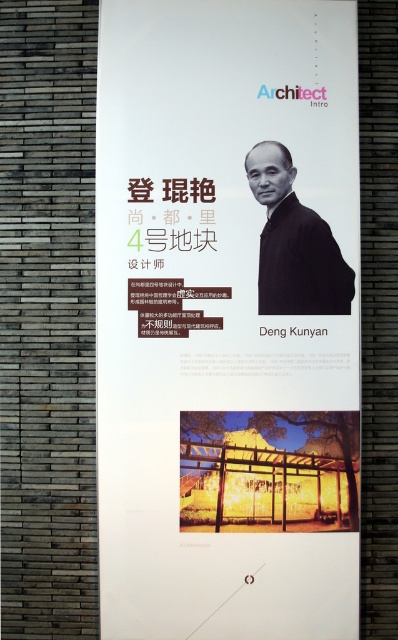
You are an interior designer planning to hang two items on a wall. You have a matte black portrait at upper center and a black matte jacket at upper right. Based on the poster design, which object should you choose to place on the left side if you want the wider item to be on the left?

The matte black portrait at upper center has a larger width than the black matte jacket at upper right, so you should place the matte black portrait at upper center on the left side to have the wider item there.

You are an interior designer who needs to hang a 30 cm wide decorative shelf between the matte black portrait at upper center and the black matte jacket at upper right. Can the shelf fit in the space between them?

The distance between the matte black portrait at upper center and the black matte jacket at upper right is 35.91 centimeters. Since the shelf is 30 cm wide, it can fit in the space between them as there is enough room.